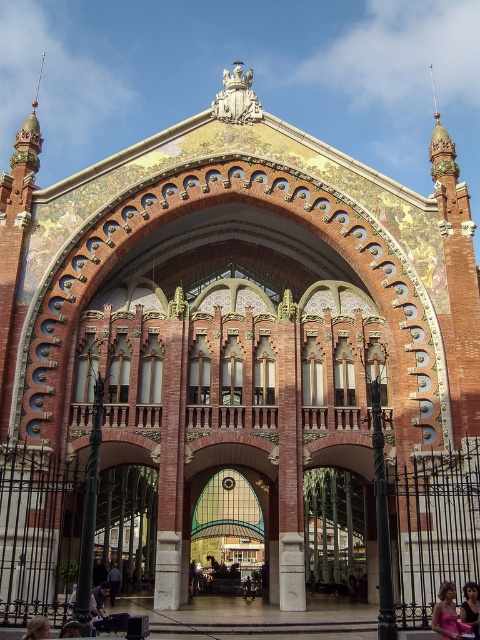
Measure the distance between point [470,605] and camera.

Point [470,605] is 125.25 feet away from camera.

Who is shorter, dark brown hair at lower right or dark blue jeans at center?

With less height is dark brown hair at lower right.

The width and height of the screenshot is (480, 640). What do you see at coordinates (470, 605) in the screenshot?
I see `dark brown hair at lower right` at bounding box center [470, 605].

Find the location of a particular element. This screenshot has width=480, height=640. dark brown hair at lower right is located at coordinates (470, 605).

Between pink fabric dress at lower right and blonde hair at lower center, which one is positioned lower?

pink fabric dress at lower right

Is point (454, 592) behind point (33, 618)?

Yes, it is behind point (33, 618).

Is point (447, 598) closer to viewer compared to point (26, 636)?

That is False.

At what (x,y) coordinates should I click in order to perform the action: click on pink fabric dress at lower right. Please return your answer as a coordinate pair (x, y). The width and height of the screenshot is (480, 640). Looking at the image, I should click on (447, 614).

Who is positioned more to the left, dark brown hair at lower right or blonde hair at lower center?

blonde hair at lower center is more to the left.

Which is above, dark brown hair at lower right or blonde hair at lower center?

Positioned higher is blonde hair at lower center.

Identify the location of dark brown hair at lower right. The image size is (480, 640). tap(470, 605).